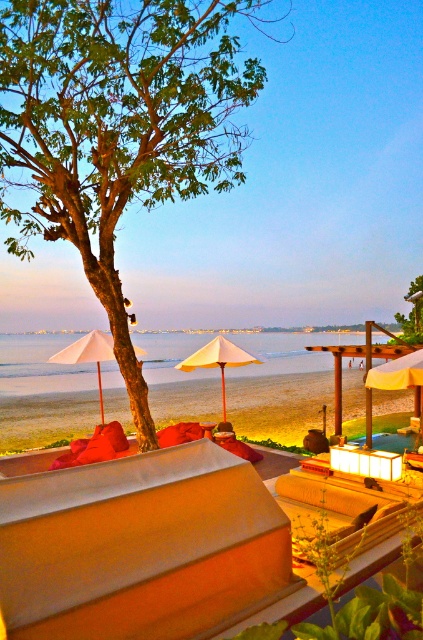
You are planning to set up a picnic area on the beach and have two umbrellas available. You need to choose the one that provides more shade. Which umbrella should you choose between the yellow fabric umbrella at center and the beige fabric umbrella at center?

The yellow fabric umbrella at center is wider than the beige fabric umbrella at center, so it provides more shade. Choose the yellow fabric umbrella at center.

You are standing at the beach and want to take a photo of both the tree and the red cushions. The coordinates of the tree are at point (230, 365) and the red cushions are at point (73, 346). If you want to ensure both are in focus, which point should you focus on first?

You should focus on point (230, 365) first because it is closer to the camera than point (73, 346), ensuring both are within the depth of field.

You are standing on the beach and want to take a photo of both the white matte umbrella at left and the green leafy tree at upper left. Which object should you focus on first to ensure both are in the frame?

You should focus on the white matte umbrella at left first because it is closer to you than the green leafy tree at upper left, ensuring both are in the frame.